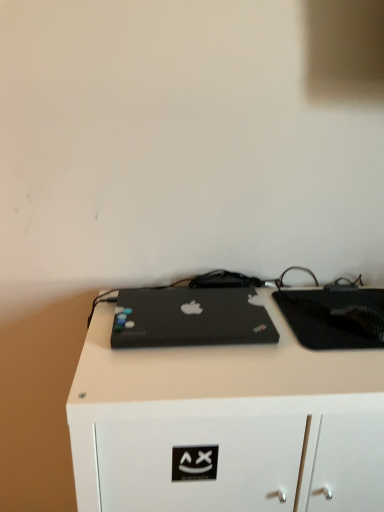
Question: Can you confirm if black matte tablet at center is taller than black matte desk at center?

Choices:
 (A) no
 (B) yes

Answer: (A)

Question: Can you confirm if black matte tablet at center is positioned to the right of black matte desk at center?

Choices:
 (A) yes
 (B) no

Answer: (A)

Question: From the image's perspective, is black matte tablet at center over black matte desk at center?

Choices:
 (A) yes
 (B) no

Answer: (A)

Question: Does black matte tablet at center have a lesser height compared to black matte desk at center?

Choices:
 (A) no
 (B) yes

Answer: (B)

Question: Does black matte tablet at center have a lesser width compared to black matte desk at center?

Choices:
 (A) no
 (B) yes

Answer: (B)

Question: Is black matte tablet at center outside of black matte desk at center?

Choices:
 (A) no
 (B) yes

Answer: (B)

Question: Considering the relative positions of black matte tablet at center and black matte laptop at center in the image provided, is black matte tablet at center to the left of black matte laptop at center from the viewer's perspective?

Choices:
 (A) no
 (B) yes

Answer: (A)

Question: Could you tell me if black matte tablet at center is turned towards black matte laptop at center?

Choices:
 (A) no
 (B) yes

Answer: (A)

Question: Is black matte tablet at center positioned in front of black matte laptop at center?

Choices:
 (A) yes
 (B) no

Answer: (B)

Question: From the image's perspective, does black matte tablet at center appear higher than black matte laptop at center?

Choices:
 (A) yes
 (B) no

Answer: (B)

Question: Are black matte tablet at center and black matte laptop at center far apart?

Choices:
 (A) no
 (B) yes

Answer: (A)

Question: From the image's perspective, is black matte tablet at center beneath black matte laptop at center?

Choices:
 (A) yes
 (B) no

Answer: (A)

Question: Can you confirm if black matte desk at center is smaller than black matte laptop at center?

Choices:
 (A) yes
 (B) no

Answer: (B)